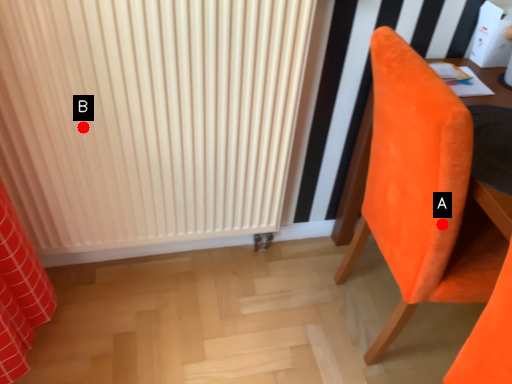
Question: Two points are circled on the image, labeled by A and B beside each circle. Which point is closer to the camera?

Choices:
 (A) A is closer
 (B) B is closer

Answer: (A)